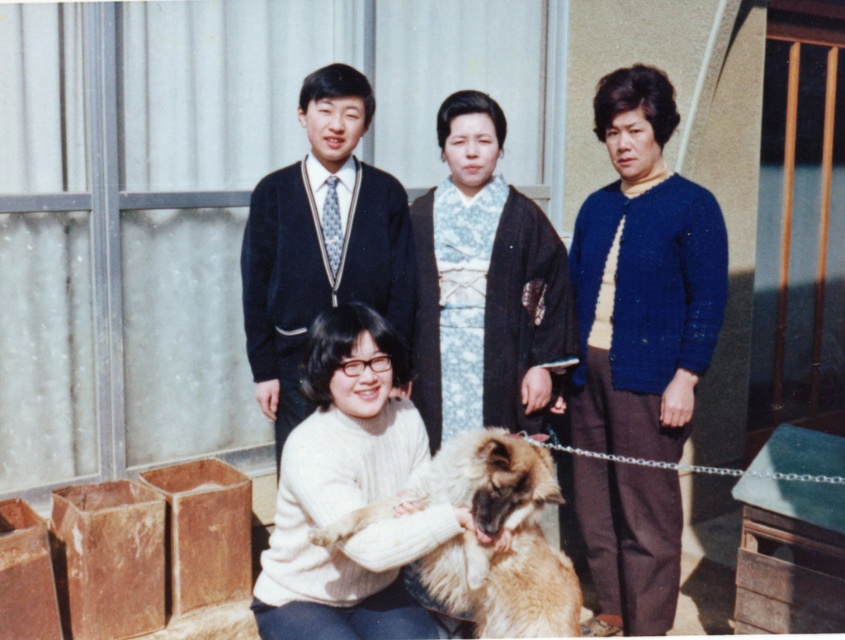
Which of these two, white wool sweater at center or fuzzy brown dog at center, stands taller?

With more height is white wool sweater at center.

Is point (391, 420) in front of point (525, 634)?

No, it is behind (525, 634).

Where is `white wool sweater at center`? white wool sweater at center is located at coordinates (347, 492).

Where is `white sweater at center`? This screenshot has height=640, width=845. white sweater at center is located at coordinates (642, 280).

Looking at this image, is white sweater at center above blue knitted cardigan at right?

No.

Where is `white sweater at center`? This screenshot has width=845, height=640. white sweater at center is located at coordinates (642, 280).

Who is more forward, (413, 625) or (296, 310)?

Positioned in front is point (413, 625).

Identify the location of white wool sweater at center. (347, 492).